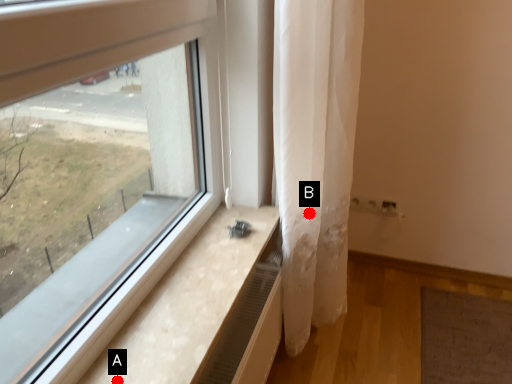
Question: Two points are circled on the image, labeled by A and B beside each circle. Which point is closer to the camera?

Choices:
 (A) A is closer
 (B) B is closer

Answer: (A)